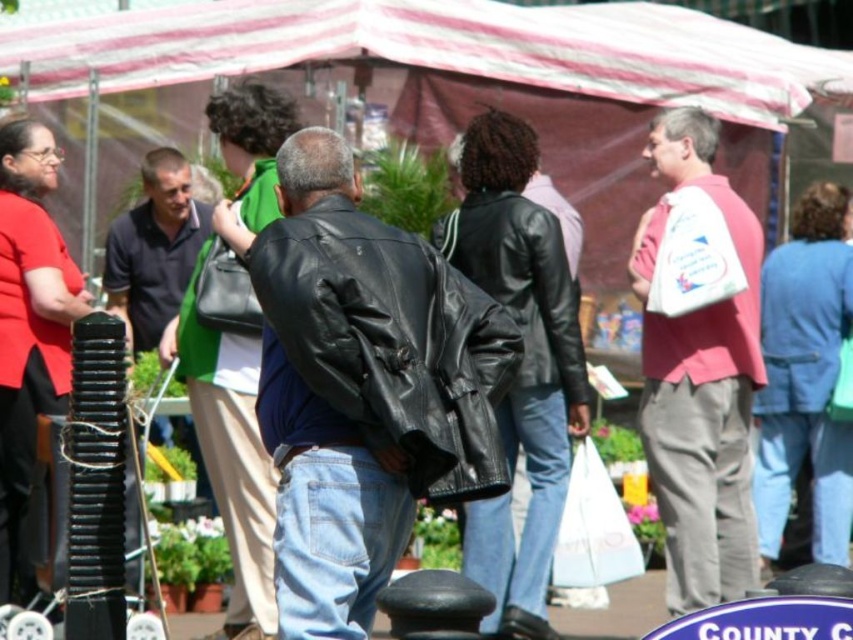
You are a customer at the market and want to pick up both the shiny black leather jacket at center and the dark green fabric bag at center. If you can carry both items in one hand, how far apart are they from each other?

The shiny black leather jacket at center and the dark green fabric bag at center are 12.69 meters apart.

Looking at this image, you are a vendor at the market and need to pack an item that requires a wider opening. Which bag, the white plastic bag at right or the dark green fabric bag at center, would you choose?

The white plastic bag at right has a larger width than the dark green fabric bag at center, so it would be better to choose the white plastic bag at right for packing an item that requires a wider opening.